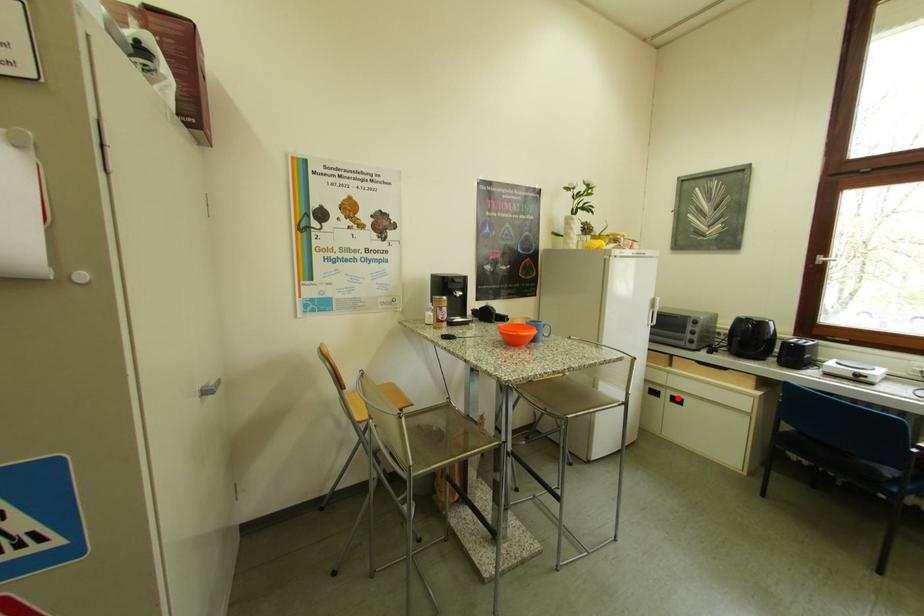
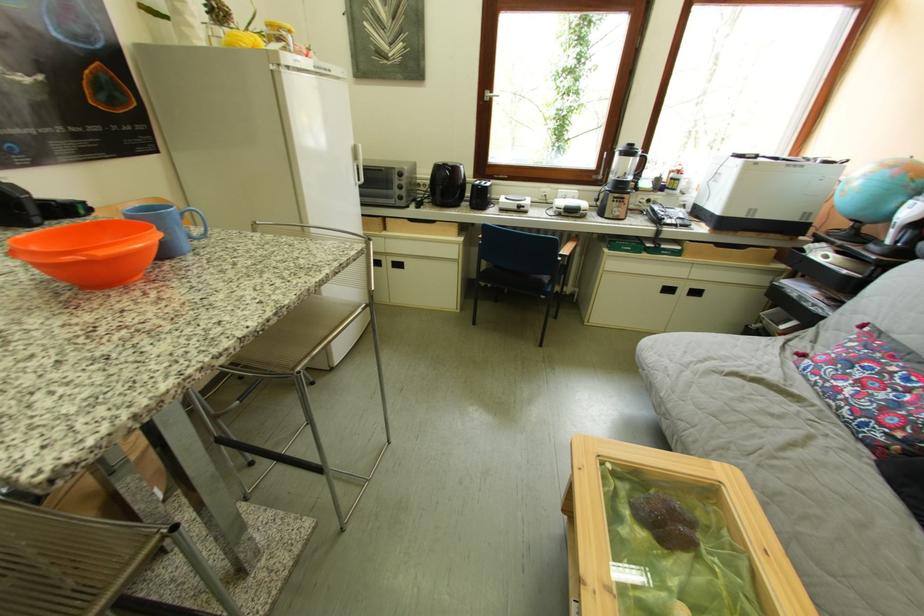
In the second image, find the point that corresponds to the highlighted location in the first image.

(399, 265)